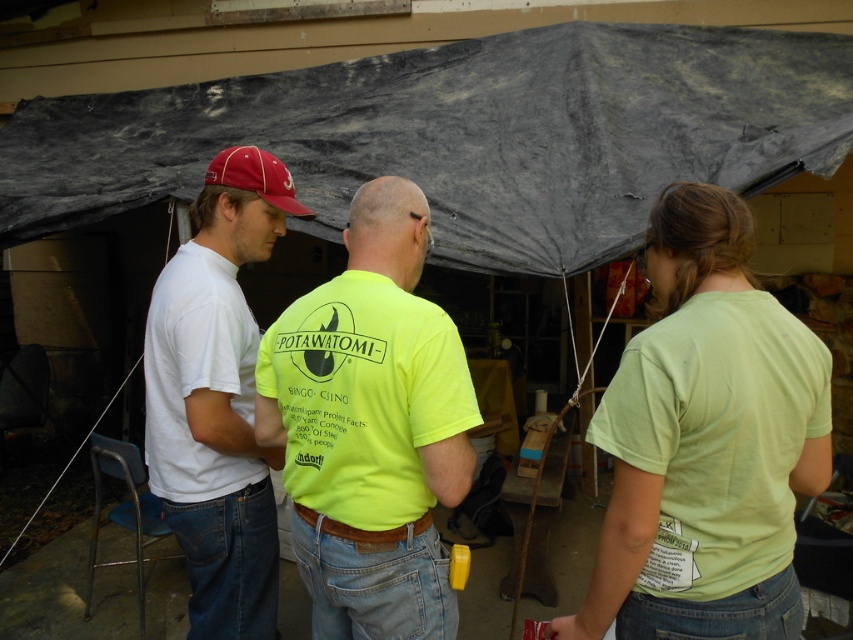
Question: From the image, what is the correct spatial relationship of lime green t-shirt at center in relation to neon yellow t-shirt at center?

Choices:
 (A) below
 (B) above

Answer: (A)

Question: Is lime green t-shirt at center to the left of matte red baseball cap at left from the viewer's perspective?

Choices:
 (A) no
 (B) yes

Answer: (A)

Question: Which object is the closest to the white cotton t-shirt at left?

Choices:
 (A) lime green t-shirt at center
 (B) neon yellow t-shirt at center

Answer: (B)

Question: Which is farther from the lime green t-shirt at center?

Choices:
 (A) white cotton t-shirt at left
 (B) matte red baseball cap at left
 (C) neon yellow t-shirt at center

Answer: (B)

Question: Which point is farther from the camera taking this photo?

Choices:
 (A) (213, 163)
 (B) (407, 355)

Answer: (A)

Question: Can you confirm if neon yellow t-shirt at center is positioned to the left of matte red baseball cap at left?

Choices:
 (A) no
 (B) yes

Answer: (A)